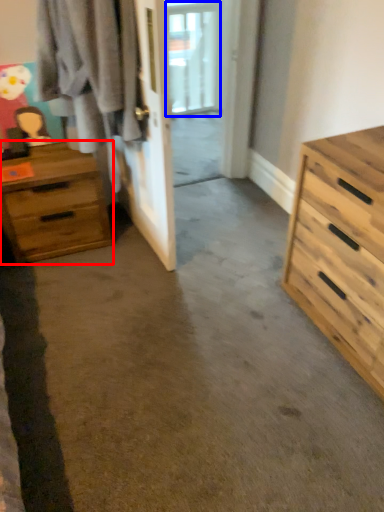
Question: Among these objects, which one is nearest to the camera, chest of drawers (highlighted by a red box) or window (highlighted by a blue box)?

Choices:
 (A) chest of drawers
 (B) window

Answer: (A)